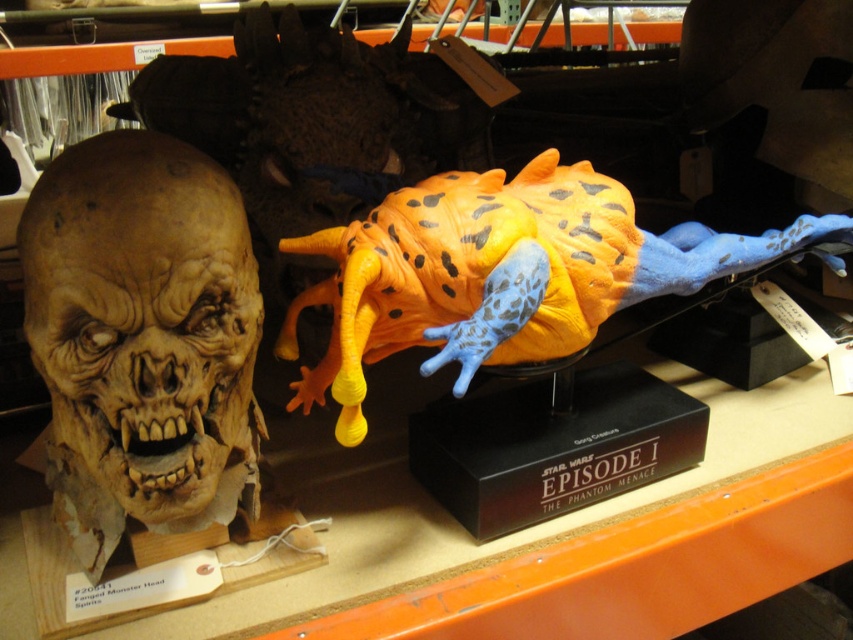
Question: Does matte plastic skull at left appear under orange spotted rubber toy at center?

Choices:
 (A) yes
 (B) no

Answer: (A)

Question: Where is matte plastic skull at left located in relation to orange spotted rubber toy at center in the image?

Choices:
 (A) left
 (B) right

Answer: (A)

Question: Can you confirm if matte plastic skull at left is positioned below orange spotted rubber toy at center?

Choices:
 (A) no
 (B) yes

Answer: (B)